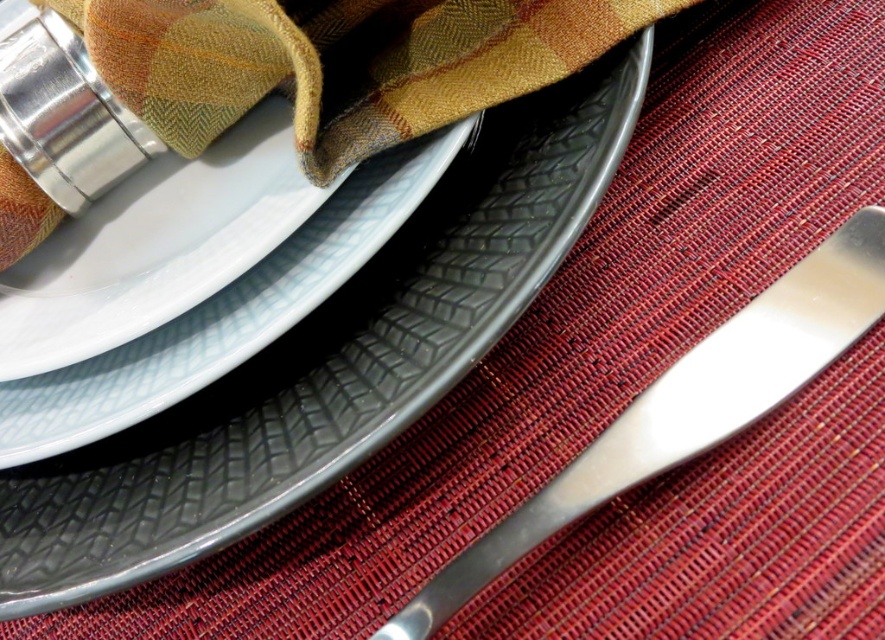
You are setting up a formal dinner and need to place the matte gray platter at center and the matte gray plate at center on the table. Which one should you place first to ensure proper stacking?

The matte gray platter at center is larger in size than the matte gray plate at center, so you should place the matte gray platter at center first to ensure proper stacking.

You are setting up a table for a dinner party and need to place a decorative centerpiece. The matte gray platter at center and the matte gray plate at center are both on the table. According to the image, where should you place the centerpiece in relation to these two items?

The matte gray platter at center is located above the matte gray plate at center, so the centerpiece should be placed below the matte gray platter at center to ensure it is above the matte gray plate at center.

You are a guest at a dinner table and want to reach for the polished metal butter knife at lower right and the matte gray plate at center. Which item will your hand touch first?

The polished metal butter knife at lower right is closer to the viewer than the matte gray plate at center, so your hand will touch the polished metal butter knife at lower right first.